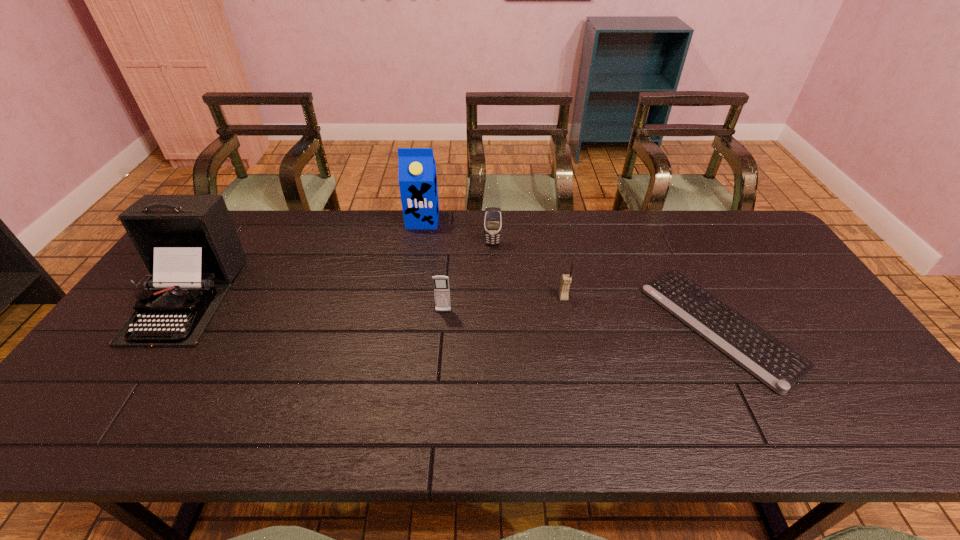
The image size is (960, 540). In order to click on the farthest object in this screenshot , I will do `click(417, 169)`.

Identify the location of the fifth object from right to left. (417, 169).

This screenshot has width=960, height=540. I want to click on the leftmost object, so click(189, 244).

Identify the location of the fourth object from right to left. (441, 283).

At what (x,y) coordinates should I click in order to perform the action: click on the leftmost cellular telephone. Please return your answer as a coordinate pair (x, y). Looking at the image, I should click on (441, 283).

I want to click on the fourth object from left to right, so click(x=492, y=216).

Find the location of a particular element. the second cellular telephone from right to left is located at coordinates (492, 216).

Image resolution: width=960 pixels, height=540 pixels. I want to click on the second farthest cellular telephone, so click(566, 280).

Locate an element on the screen. The width and height of the screenshot is (960, 540). the rightmost cellular telephone is located at coordinates (566, 280).

Where is `computer keyboard`? computer keyboard is located at coordinates (x=778, y=366).